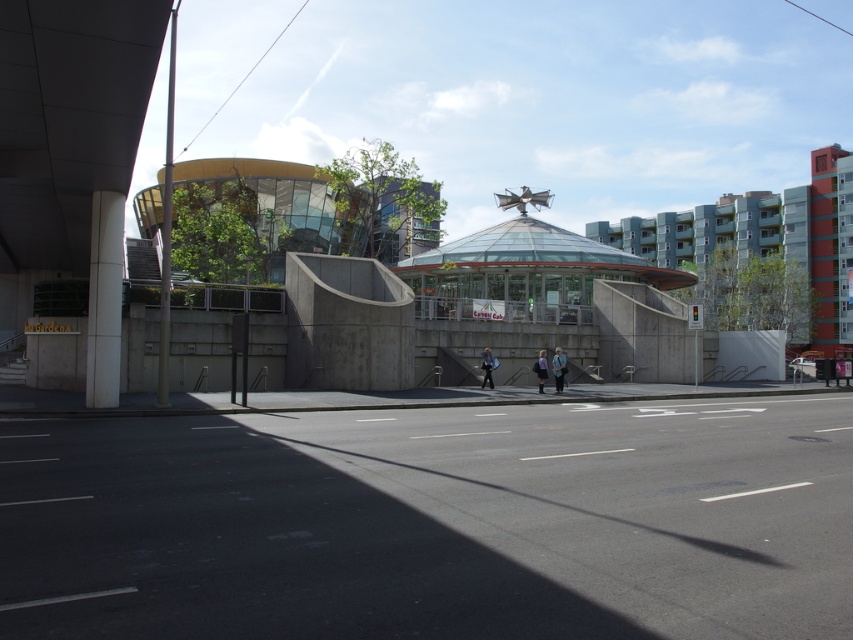
Is blue denim jacket at center thinner than light blue denim jacket at center?

Correct, blue denim jacket at center's width is less than light blue denim jacket at center's.

How much distance is there between blue denim jacket at center and light blue denim jacket at center?

The distance of blue denim jacket at center from light blue denim jacket at center is 7.78 feet.

Which is behind, point (556, 385) or point (485, 356)?

Point (485, 356)

In order to click on blue denim jacket at center in this screenshot , I will do `click(558, 369)`.

Is light blue denim jacket at center bigger than purple fabric bag at center?

No.

Between light blue denim jacket at center and purple fabric bag at center, which one is positioned lower?

light blue denim jacket at center is lower down.

What are the coordinates of `light blue denim jacket at center` in the screenshot? It's located at (486, 368).

The image size is (853, 640). Identify the location of light blue denim jacket at center. (486, 368).

Can you confirm if blue denim jacket at center is wider than purple fabric bag at center?

No.

Who is more distant from viewer, (x=563, y=364) or (x=543, y=353)?

Point (x=543, y=353)

This screenshot has width=853, height=640. What are the coordinates of `blue denim jacket at center` in the screenshot? It's located at (558, 369).